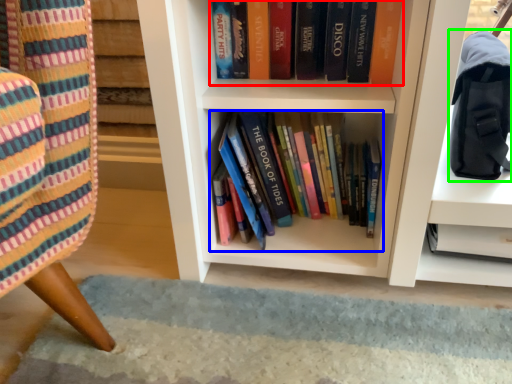
Question: Which object is the closest to the book (highlighted by a red box)? Choose among these: book (highlighted by a blue box) or shoulder bag (highlighted by a green box).

Choices:
 (A) book
 (B) shoulder bag

Answer: (B)